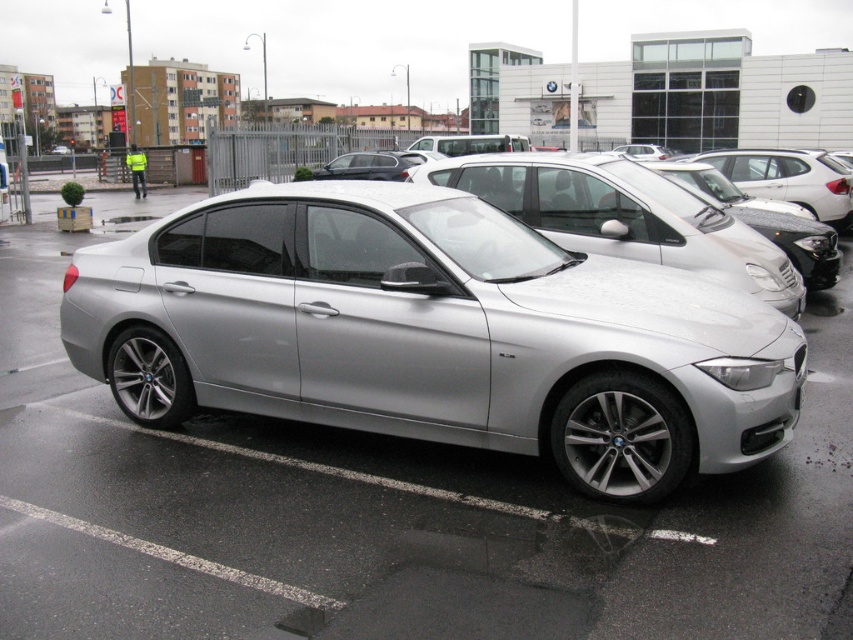
You are a delivery person trying to park your van in the parking lot. You see the satin silver car at center and the satin silver sedan at center. Which one is shorter in height?

The satin silver car at center is not as tall as the satin silver sedan at center, so the satin silver car at center is shorter in height.

You are a delivery person trying to park a 5.5 meter long truck in the parking lot. You see the satin silver car at center and the satin silver sedan at center. Can you fit your truck between them without touching either vehicle?

The satin silver car at center and satin silver sedan at center are 6.76 meters apart. Since your truck is 5.5 meters long, there is enough space between them to park without touching either vehicle.

You are standing in the parking lot looking at the silver BMW sedan. There are two points marked on the car. One is at coordinate point(602, 173) and the other at point(785, 157). Which point is closer to you?

Point(602, 173) is closer to the viewer than point(785, 157).